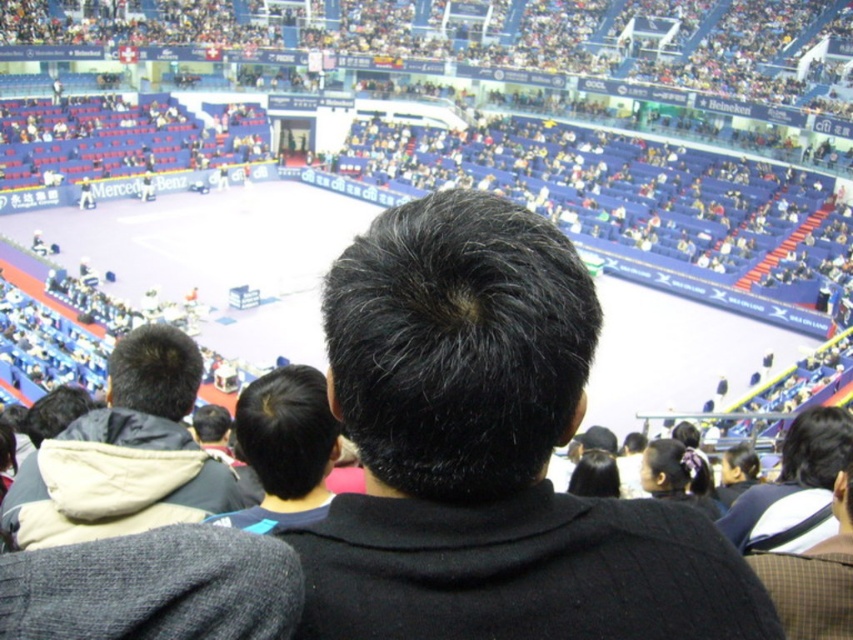
You are sitting in the sports arena and want to know if the point at coordinate (74, 522) is closer to you than the point at (254, 419). Can you determine this based on your current position?

Yes, since point (74, 522) is in front of point (254, 419), it is closer to you.

You are sitting in the stands of a sports arena and notice two items in front of you. The first is the black matte hair at center, and the second is the dark gray jacket at center. Which of these two items has a greater width from your viewpoint?

The black matte hair at center is wider than the dark gray jacket at center according to the description provided.

You are sitting in the stands of an indoor sports arena and notice two people in front of you. One has black matte hair at center and the other has dark brown hair at center. Which person has a hairstyle that appears taller?

The black matte hair at center is much taller as dark brown hair at center, so the person with black matte hair at center has a taller hairstyle.